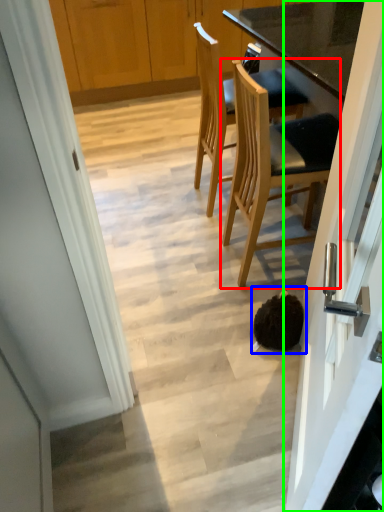
Question: Considering the real-world distances, which object is farthest from chair (highlighted by a red box)? head (highlighted by a blue box) or door (highlighted by a green box)?

Choices:
 (A) head
 (B) door

Answer: (B)